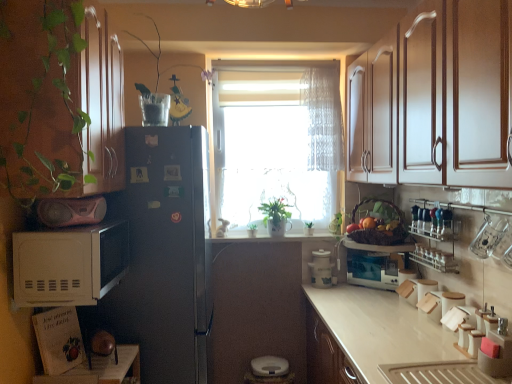
Question: From their relative heights in the image, would you say orange matte at right is taller or shorter than translucent fabric curtain at center?

Choices:
 (A) short
 (B) tall

Answer: (A)

Question: Is point (369, 220) positioned closer to the camera than point (337, 72)?

Choices:
 (A) farther
 (B) closer

Answer: (B)

Question: Which object is positioned farthest from the brown woven basket at center?

Choices:
 (A) green matte plant at center
 (B) pink matte boombox at left, positioned as the fourth appliance in bottom-to-top order
 (C) black matte refrigerator at left
 (D) white glossy cabinet at upper right, positioned as the first cabinetry in right-to-left order
 (E) white matte microwave at left

Answer: (B)

Question: Which of these objects is positioned closest to the clear glass bottles at upper right?

Choices:
 (A) black matte refrigerator at left
 (B) white glossy toaster oven at center, positioned as the 2th appliance in bottom-to-top order
 (C) orange matte at right
 (D) clear glass vase at upper center
 (E) translucent fabric curtain at center

Answer: (B)